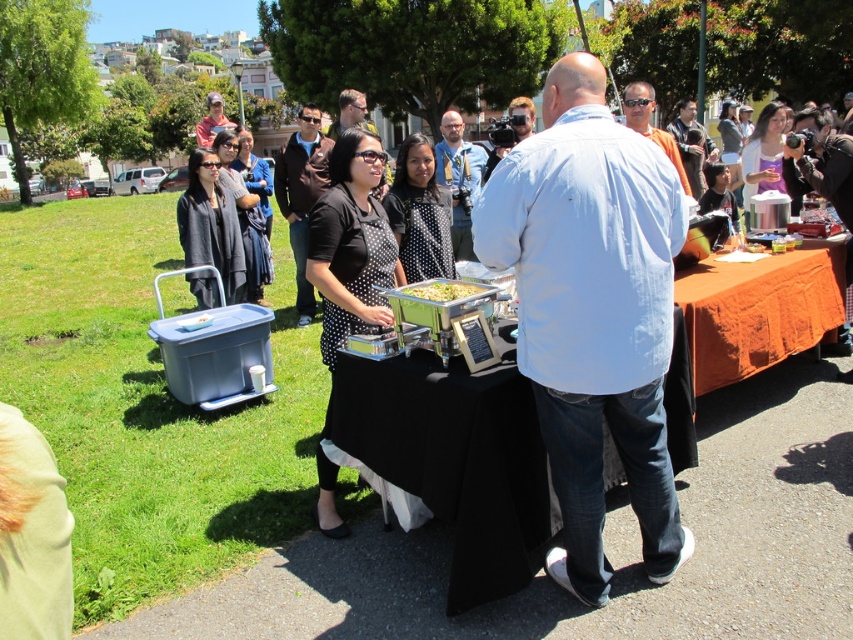
Question: Does light blue denim shirt at center appear under matte blue shirt at center?

Choices:
 (A) yes
 (B) no

Answer: (A)

Question: From the image, what is the correct spatial relationship of matte black shirt at center in relation to matte gray shirt at upper center?

Choices:
 (A) right
 (B) left

Answer: (A)

Question: Which of these objects is positioned farthest from the matte blue shirt at center?

Choices:
 (A) light blue denim shirt at center
 (B) light blue shirt at center
 (C) matte black shirt at center
 (D) orange t-shirt at center

Answer: (C)

Question: Which of the following is the farthest from the observer?

Choices:
 (A) (216, 109)
 (B) (430, 291)
 (C) (308, 317)
 (D) (689, 188)

Answer: (A)

Question: Is light blue shirt at center positioned at the back of matte gray shirt at upper center?

Choices:
 (A) yes
 (B) no

Answer: (B)

Question: Which object is closer to the camera taking this photo?

Choices:
 (A) matte black shirt at center
 (B) matte gray shirt at upper center

Answer: (A)